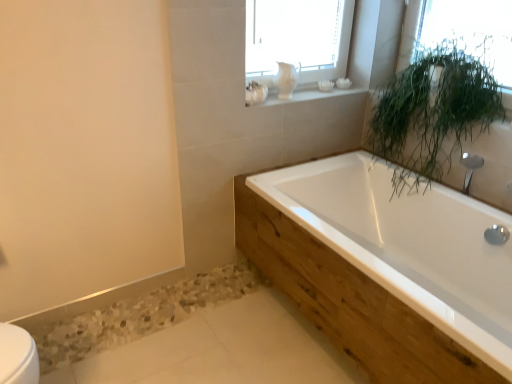
The width and height of the screenshot is (512, 384). Identify the location of blank space situated above white ceramic objects at upper center (from a real-world perspective). (308, 90).